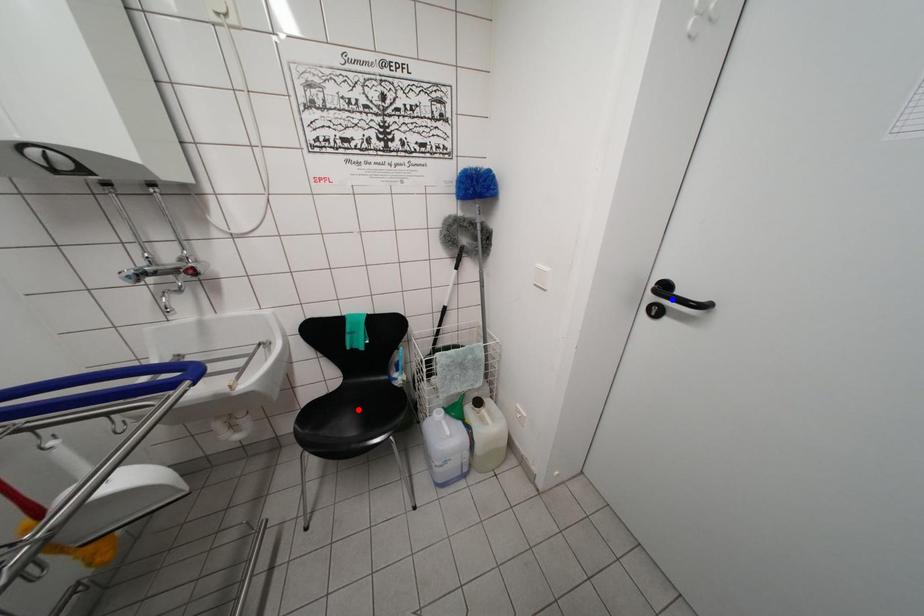
Question: Which of the two points in the image is closer to the camera?

Choices:
 (A) Blue point is closer.
 (B) Red point is closer.

Answer: (A)